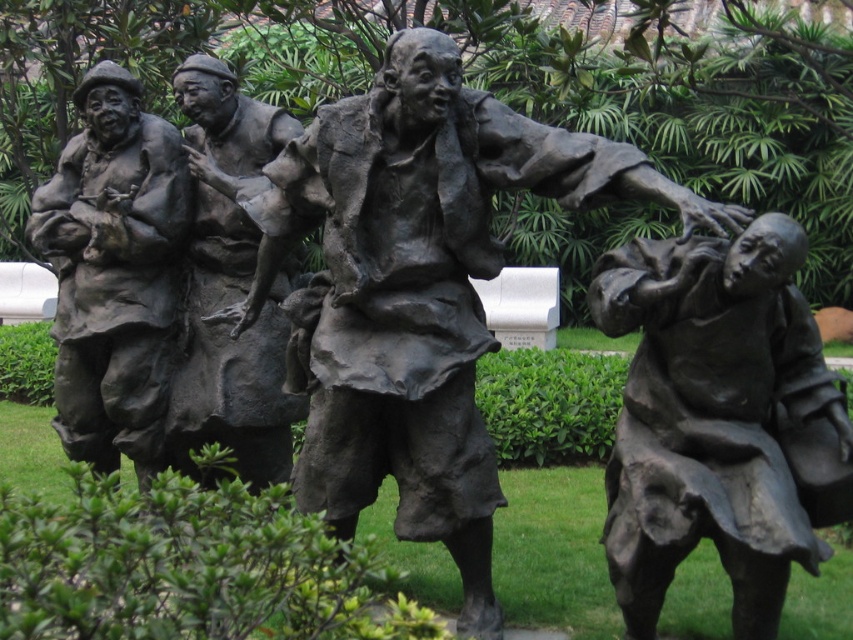
Question: Considering the real-world distances, which object is farthest from the bronze statue of man at center?

Choices:
 (A) bronze statue at left
 (B) bronze statue at right

Answer: (B)

Question: Can you confirm if bronze statue at right is bigger than bronze statue of man at center?

Choices:
 (A) no
 (B) yes

Answer: (B)

Question: Is bronze statue at right wider than bronze statue of man at center?

Choices:
 (A) yes
 (B) no

Answer: (A)

Question: Which object appears closest to the camera in this image?

Choices:
 (A) bronze statue at left
 (B) bronze statue of man at center

Answer: (B)

Question: Does bronze statue at right appear over bronze statue at left?

Choices:
 (A) no
 (B) yes

Answer: (A)

Question: Which point is farther to the camera?

Choices:
 (A) (189, 433)
 (B) (730, 397)
 (C) (73, 429)

Answer: (C)